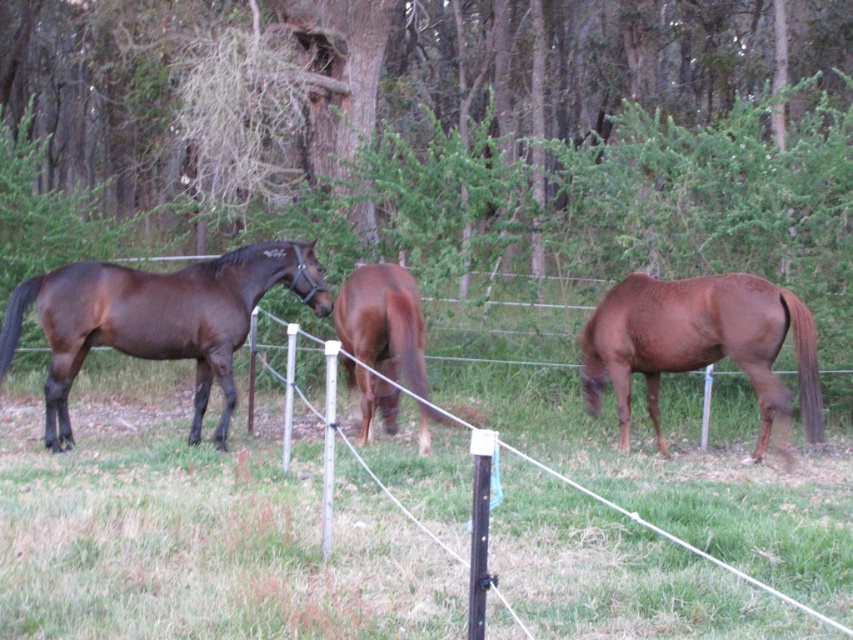
Question: Which point is closer to the camera?

Choices:
 (A) brown glossy horse at center
 (B) shiny dark brown horse at left
 (C) brown glossy horse at right

Answer: (A)

Question: Is shiny dark brown horse at left to the right of brown glossy horse at right from the viewer's perspective?

Choices:
 (A) no
 (B) yes

Answer: (A)

Question: Which of these objects is positioned farthest from the brown glossy horse at center?

Choices:
 (A) shiny dark brown horse at left
 (B) brown glossy horse at right

Answer: (B)

Question: Which point is closer to the camera taking this photo?

Choices:
 (A) (386, 372)
 (B) (633, 300)
 (C) (221, 333)

Answer: (C)

Question: Does shiny dark brown horse at left have a larger size compared to brown glossy horse at right?

Choices:
 (A) yes
 (B) no

Answer: (B)

Question: Can you confirm if brown glossy horse at right is smaller than brown glossy horse at center?

Choices:
 (A) yes
 (B) no

Answer: (B)